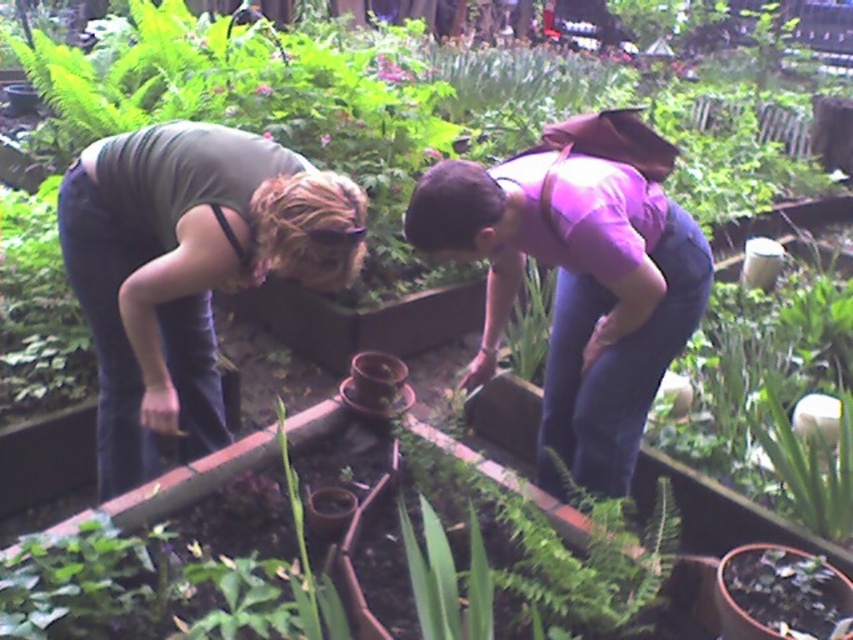
Who is higher up, matte green shirt at left or green matte plant at center?

matte green shirt at left

Who is more forward, (137, 387) or (804, 570)?

Point (804, 570)

Image resolution: width=853 pixels, height=640 pixels. Identify the location of matte green shirt at left. (187, 269).

Between point (91, 243) and point (606, 390), which one is positioned behind?

The point (606, 390) is more distant.

Can you confirm if matte green shirt at left is wider than purple matte shirt at center?

Correct, the width of matte green shirt at left exceeds that of purple matte shirt at center.

Which is in front, point (128, 248) or point (683, 262)?

Positioned in front is point (683, 262).

Where is `matte green shirt at left`? The image size is (853, 640). matte green shirt at left is located at coordinates (187, 269).

Can you confirm if purple matte shirt at center is shorter than green matte plant at center?

In fact, purple matte shirt at center may be taller than green matte plant at center.

Is point (473, 168) positioned before point (729, 557)?

No, it is not.

Who is more distant from viewer, (549, 188) or (718, 573)?

The point (549, 188) is more distant.

Image resolution: width=853 pixels, height=640 pixels. What are the coordinates of `purple matte shirt at center` in the screenshot? It's located at (579, 276).